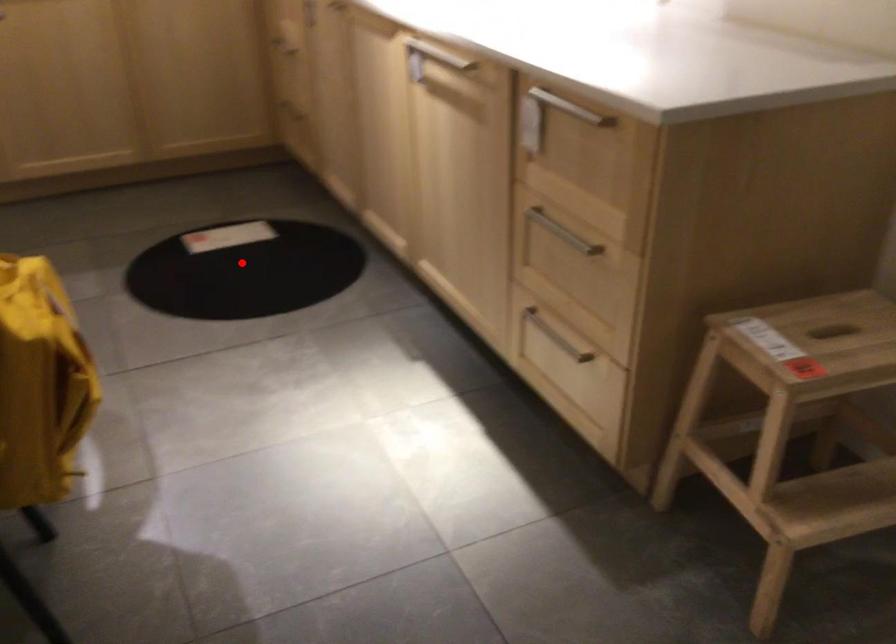
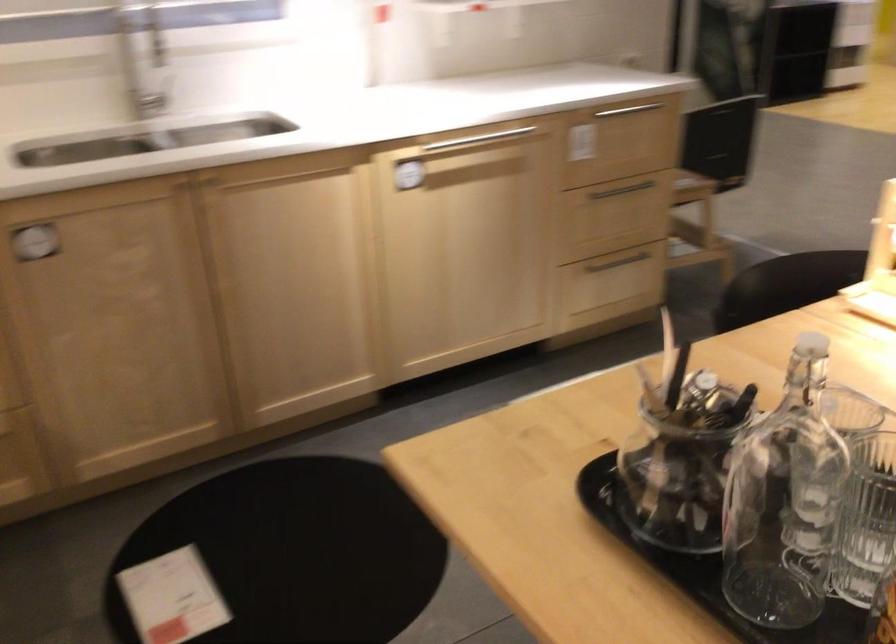
Question: I am providing you with two images of the same scene from different viewpoints. A red point is shown in image1. For the corresponding object point in image2, is it positioned nearer or farther from the camera?

Choices:
 (A) Nearer
 (B) Farther

Answer: (A)